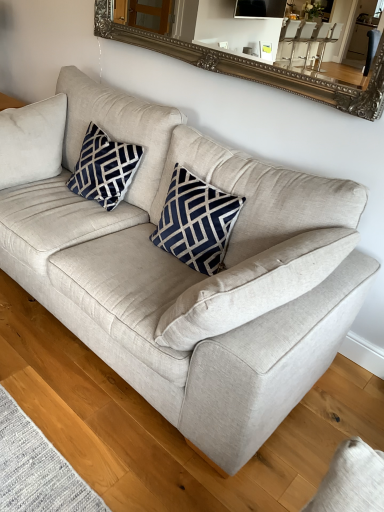
Identify the location of silver ornate mirror at upper center. (254, 67).

From the image's perspective, which is above, silver ornate mirror at upper center or navy blue textured pillow at center?

silver ornate mirror at upper center appears higher in the image.

Which is correct: silver ornate mirror at upper center is inside navy blue textured pillow at center, or outside of it?

silver ornate mirror at upper center is spatially situated outside navy blue textured pillow at center.

Is silver ornate mirror at upper center aimed at navy blue textured pillow at center?

No, silver ornate mirror at upper center is not facing towards navy blue textured pillow at center.

Locate an element on the screen. mirror above the navy blue textured pillow at center (from a real-world perspective) is located at coordinates (254, 67).

Can you tell me how much navy blue textured pillow at center and silver ornate mirror at upper center differ in facing direction?

0.168 degrees.

Considering the positions of point (231, 207) and point (213, 51), is point (231, 207) closer or farther from the camera than point (213, 51)?

Point (231, 207) is positioned closer to the camera compared to point (213, 51).

Based on their positions, is navy blue textured pillow at center located to the left or right of silver ornate mirror at upper center?

navy blue textured pillow at center is positioned on silver ornate mirror at upper center's left side.

From a real-world perspective, between navy blue textured pillow at center and silver ornate mirror at upper center, who is vertically lower?

From a 3D spatial view, navy blue textured pillow at center is below.

Between navy velvet pillow at upper left and navy blue textured pillow at center, which one has less height?

navy velvet pillow at upper left.

Based on the photo, would you consider navy velvet pillow at upper left to be distant from navy blue textured pillow at center?

No, navy velvet pillow at upper left is not far away from navy blue textured pillow at center.

From a real-world perspective, does navy velvet pillow at upper left sit lower than navy blue textured pillow at center?

No, from a real-world perspective, navy velvet pillow at upper left is not under navy blue textured pillow at center.

Is silver ornate mirror at upper center facing away from navy velvet pillow at upper left?

That's not correct — silver ornate mirror at upper center is not looking away from navy velvet pillow at upper left.

Can you tell me how much silver ornate mirror at upper center and navy velvet pillow at upper left differ in facing direction?

0.446 degrees.

From the image's perspective, is silver ornate mirror at upper center under navy velvet pillow at upper left?

Incorrect, from the image's perspective, silver ornate mirror at upper center is higher than navy velvet pillow at upper left.

Who is taller, navy blue textured pillow at center or navy velvet pillow at upper left?

With more height is navy blue textured pillow at center.

Which object is positioned more to the right, navy blue textured pillow at center or navy velvet pillow at upper left?

Positioned to the right is navy blue textured pillow at center.

Is point (195, 201) behind point (95, 187)?

No.

Does navy blue textured pillow at center lie in front of navy velvet pillow at upper left?

Yes, it is.

Is navy velvet pillow at upper left to the right of silver ornate mirror at upper center from the viewer's perspective?

No.

Which of these two, navy velvet pillow at upper left or silver ornate mirror at upper center, is bigger?

silver ornate mirror at upper center.

In terms of width, does navy velvet pillow at upper left look wider or thinner when compared to silver ornate mirror at upper center?

Clearly, navy velvet pillow at upper left has more width compared to silver ornate mirror at upper center.

From the image's perspective, is navy velvet pillow at upper left under silver ornate mirror at upper center?

Correct, navy velvet pillow at upper left appears lower than silver ornate mirror at upper center in the image.

Find the location of a particular element. The height and width of the screenshot is (512, 384). mirror that is above the navy blue textured pillow at center (from the image's perspective) is located at coordinates (254, 67).

I want to click on throw pillow below the silver ornate mirror at upper center (from a real-world perspective), so click(x=196, y=222).

Considering their positions, is silver ornate mirror at upper center positioned closer to navy velvet pillow at upper left than navy blue textured pillow at center?

Based on the image, navy blue textured pillow at center appears to be nearer to navy velvet pillow at upper left.

Looking at the image, which one is located further to navy blue textured pillow at center, navy velvet pillow at upper left or silver ornate mirror at upper center?

silver ornate mirror at upper center is positioned further to the anchor navy blue textured pillow at center.

Considering their positions, is navy blue textured pillow at center positioned further to navy velvet pillow at upper left than silver ornate mirror at upper center?

Among the two, silver ornate mirror at upper center is located further to navy velvet pillow at upper left.

Which object lies nearer to the anchor point silver ornate mirror at upper center, navy velvet pillow at upper left or navy blue textured pillow at center?

The object closer to silver ornate mirror at upper center is navy velvet pillow at upper left.

Looking at the image, which one is located further to silver ornate mirror at upper center, navy blue textured pillow at center or navy velvet pillow at upper left?

navy blue textured pillow at center.

Consider the image. Based on their spatial positions, is silver ornate mirror at upper center or navy velvet pillow at upper left further from navy blue textured pillow at center?

silver ornate mirror at upper center is positioned further to the anchor navy blue textured pillow at center.

In order to click on pillow between silver ornate mirror at upper center and navy blue textured pillow at center in the vertical direction in this screenshot , I will do `click(104, 168)`.